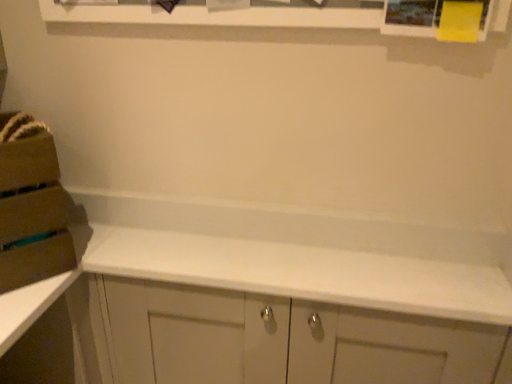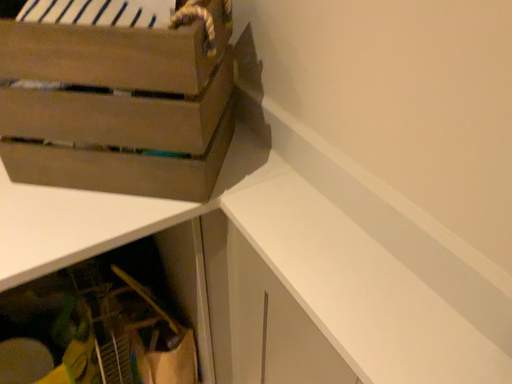
Question: How did the camera likely rotate when shooting the video?

Choices:
 (A) rotated right
 (B) rotated left

Answer: (B)